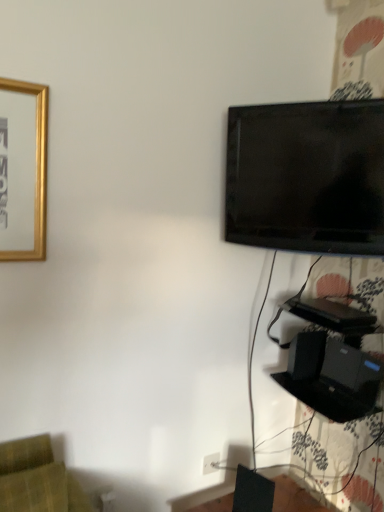
The width and height of the screenshot is (384, 512). Describe the element at coordinates (211, 463) in the screenshot. I see `white plastic electric outlet at lower center` at that location.

The image size is (384, 512). Describe the element at coordinates (252, 492) in the screenshot. I see `black matte speaker at lower right, placed as the second speaker when sorted from top to bottom` at that location.

Identify the location of black matte speaker at lower right, which is the first speaker from top to bottom. (306, 355).

From a real-world perspective, which is physically below, white plastic electric outlet at lower center or black matte speaker at lower right, which ranks as the first speaker in bottom-to-top order?

white plastic electric outlet at lower center is physically lower.

Who is taller, white plastic electric outlet at lower center or black matte speaker at lower right, which ranks as the first speaker in bottom-to-top order?

black matte speaker at lower right, which ranks as the first speaker in bottom-to-top order.

Which speaker is the 2nd one when counting from the front of the white plastic electric outlet at lower center? Please provide its 2D coordinates.

[(252, 492)]

From the picture: Which is correct: white plastic electric outlet at lower center is inside black matte speaker at lower right, marked as the second speaker in a right-to-left arrangement, or outside of it?

white plastic electric outlet at lower center is spatially situated outside black matte speaker at lower right, marked as the second speaker in a right-to-left arrangement.

Which object is more forward, black matte speaker at lower right, which ranks as the first speaker in front-to-back order, or white plastic electric outlet at lower center?

black matte speaker at lower right, which ranks as the first speaker in front-to-back order.

From a real-world perspective, is black matte speaker at lower right, placed as the second speaker when sorted from top to bottom, physically located above or below white plastic electric outlet at lower center?

Clearly, from a real-world perspective, black matte speaker at lower right, placed as the second speaker when sorted from top to bottom, is above white plastic electric outlet at lower center.

Which point is more forward, (240, 472) or (209, 456)?

The point (240, 472) is closer to the camera.

Is black matte speaker at lower right, placed as the second speaker when sorted from top to bottom, taller than white plastic electric outlet at lower center?

Yes, black matte speaker at lower right, placed as the second speaker when sorted from top to bottom, is taller than white plastic electric outlet at lower center.

Between black matte speaker at lower right, the 1th speaker viewed from the right, and black glossy tv at upper right, which one has larger width?

With larger width is black matte speaker at lower right, the 1th speaker viewed from the right.

Based on the photo, considering the sizes of objects black matte speaker at lower right, which is the 2th speaker from bottom to top, and black glossy tv at upper right in the image provided, who is bigger, black matte speaker at lower right, which is the 2th speaker from bottom to top, or black glossy tv at upper right?

black glossy tv at upper right is bigger.

Between point (306, 332) and point (281, 232), which one is positioned in front?

Point (281, 232)

Who is bigger, white plastic electric outlet at lower center or black glossy tv at upper right?

Bigger between the two is black glossy tv at upper right.

From the image's perspective, is white plastic electric outlet at lower center located above black glossy tv at upper right?

No, from the image's perspective, white plastic electric outlet at lower center is not above black glossy tv at upper right.

Does white plastic electric outlet at lower center have a lesser width compared to black glossy tv at upper right?

Yes.

Which is in front, white plastic electric outlet at lower center or black glossy tv at upper right?

black glossy tv at upper right is closer to the camera.

Based on their positions, is black matte speaker at lower right, the 1th speaker viewed from the right, located to the left or right of white plastic electric outlet at lower center?

In the image, black matte speaker at lower right, the 1th speaker viewed from the right, appears on the right side of white plastic electric outlet at lower center.

Considering the sizes of black matte speaker at lower right, which is the second speaker from left to right, and white plastic electric outlet at lower center in the image, is black matte speaker at lower right, which is the second speaker from left to right, wider or thinner than white plastic electric outlet at lower center?

In the image, black matte speaker at lower right, which is the second speaker from left to right, appears to be wider than white plastic electric outlet at lower center.

Which object is closer to the camera, black matte speaker at lower right, which is the 2th speaker from bottom to top, or white plastic electric outlet at lower center?

black matte speaker at lower right, which is the 2th speaker from bottom to top, is in front.

Can we say black glossy tv at upper right lies outside black matte speaker at lower right, which is the second speaker from left to right?

Indeed, black glossy tv at upper right is completely outside black matte speaker at lower right, which is the second speaker from left to right.

Are black glossy tv at upper right and black matte speaker at lower right, placed as the 1th speaker when sorted from back to front, located far from each other?

Result: No, black glossy tv at upper right is in close proximity to black matte speaker at lower right, placed as the 1th speaker when sorted from back to front.

Between black glossy tv at upper right and black matte speaker at lower right, which is the first speaker from top to bottom, which one appears on the right side from the viewer's perspective?

black matte speaker at lower right, which is the first speaker from top to bottom.

How different are the orientations of black glossy tv at upper right and black matte speaker at lower right, the 1th speaker viewed from the right, in degrees?

The angular difference between black glossy tv at upper right and black matte speaker at lower right, the 1th speaker viewed from the right, is 40.1 degrees.

Can you confirm if black matte speaker at lower right, which ranks as the first speaker in front-to-back order, is bigger than black matte speaker at lower right, placed as the 1th speaker when sorted from back to front?

No.

Would you say black matte speaker at lower right, marked as the second speaker in a right-to-left arrangement, is outside black matte speaker at lower right, which is the first speaker from top to bottom?

Yes.

Is point (245, 482) more distant than point (312, 342)?

No, (245, 482) is in front of (312, 342).

At what (x,y) coordinates should I click in order to perform the action: click on electric outlet that appears above the black matte speaker at lower right, which ranks as the second speaker in back-to-front order (from the image's perspective). Please return your answer as a coordinate pair (x, y). Looking at the image, I should click on (211, 463).

Where is `the 1st speaker located above the white plastic electric outlet at lower center (from a real-world perspective)`? Image resolution: width=384 pixels, height=512 pixels. the 1st speaker located above the white plastic electric outlet at lower center (from a real-world perspective) is located at coordinates (252, 492).

From the image, which object appears to be nearer to white plastic electric outlet at lower center, black matte speaker at lower right, the 1th speaker viewed from the right, or black matte speaker at lower right, placed as the second speaker when sorted from top to bottom?

black matte speaker at lower right, placed as the second speaker when sorted from top to bottom, is positioned closer to the anchor white plastic electric outlet at lower center.

Looking at the image, which one is located closer to white plastic electric outlet at lower center, black glossy tv at upper right or black matte speaker at lower right, which ranks as the first speaker in front-to-back order?

black matte speaker at lower right, which ranks as the first speaker in front-to-back order, is closer to white plastic electric outlet at lower center.

From the image, which object appears to be nearer to black matte speaker at lower right, which is the 2th speaker from bottom to top, black glossy tv at upper right or white plastic electric outlet at lower center?

white plastic electric outlet at lower center is positioned closer to the anchor black matte speaker at lower right, which is the 2th speaker from bottom to top.

Which object lies nearer to the anchor point black glossy tv at upper right, white plastic electric outlet at lower center or black matte speaker at lower right, which is the 2th speaker from bottom to top?

Based on the image, black matte speaker at lower right, which is the 2th speaker from bottom to top, appears to be nearer to black glossy tv at upper right.

Estimate the real-world distances between objects in this image. Which object is closer to black matte speaker at lower right, which ranks as the first speaker in bottom-to-top order, white plastic electric outlet at lower center or black matte speaker at lower right, which is the first speaker from top to bottom?

white plastic electric outlet at lower center.

Which object lies further to the anchor point black matte speaker at lower right, placed as the 1th speaker when sorted from back to front, black matte speaker at lower right, marked as the second speaker in a right-to-left arrangement, or black glossy tv at upper right?

black glossy tv at upper right lies further to black matte speaker at lower right, placed as the 1th speaker when sorted from back to front, than the other object.

From the image, which object appears to be farther from black matte speaker at lower right, which appears as the 1th speaker when viewed from the left, black glossy tv at upper right or black matte speaker at lower right, which is the 2th speaker from bottom to top?

black glossy tv at upper right.

When comparing their distances from white plastic electric outlet at lower center, does black matte speaker at lower right, which ranks as the second speaker in back-to-front order, or black matte speaker at lower right, which is the first speaker from top to bottom, seem closer?

black matte speaker at lower right, which ranks as the second speaker in back-to-front order, is positioned closer to the anchor white plastic electric outlet at lower center.

The width and height of the screenshot is (384, 512). I want to click on speaker that lies between black glossy tv at upper right and black matte speaker at lower right, placed as the second speaker when sorted from top to bottom, from top to bottom, so click(x=306, y=355).

Find the location of a particular element. The image size is (384, 512). electric outlet between black matte speaker at lower right, placed as the 1th speaker when sorted from back to front, and black matte speaker at lower right, which ranks as the first speaker in bottom-to-top order, from top to bottom is located at coordinates (211, 463).

The height and width of the screenshot is (512, 384). Identify the location of electric outlet between black glossy tv at upper right and black matte speaker at lower right, which ranks as the second speaker in back-to-front order, from top to bottom. click(211, 463).

I want to click on speaker between black glossy tv at upper right and white plastic electric outlet at lower center in the up-down direction, so click(306, 355).